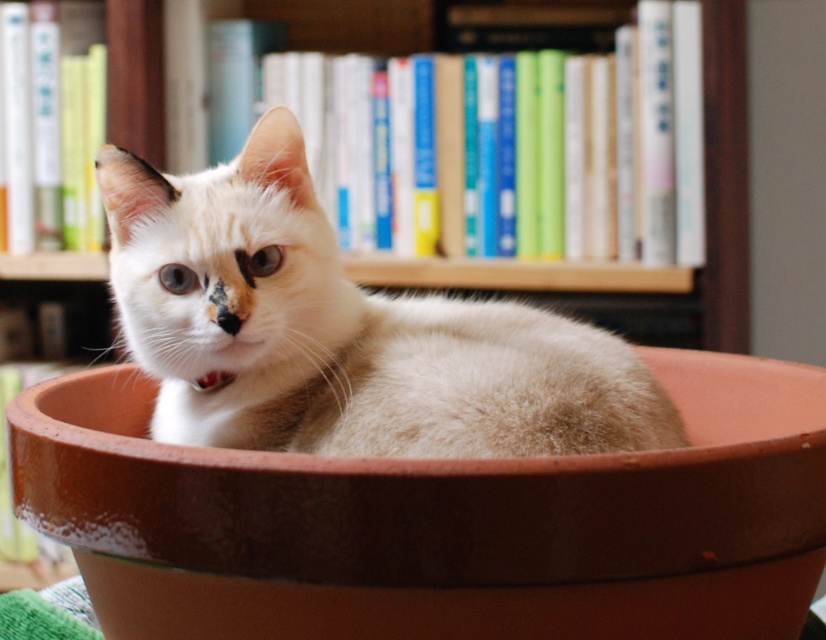
Question: Which point is closer to the camera?

Choices:
 (A) (326, 509)
 (B) (184, 326)

Answer: (A)

Question: Among these objects, which one is farthest from the camera?

Choices:
 (A) terracotta clay bowl at center
 (B) soft white fur cat at center

Answer: (B)

Question: From the image, what is the correct spatial relationship of terracotta clay bowl at center in relation to soft white fur cat at center?

Choices:
 (A) below
 (B) above

Answer: (A)

Question: Does terracotta clay bowl at center have a greater width compared to soft white fur cat at center?

Choices:
 (A) yes
 (B) no

Answer: (A)

Question: Is terracotta clay bowl at center to the left of soft white fur cat at center from the viewer's perspective?

Choices:
 (A) yes
 (B) no

Answer: (B)